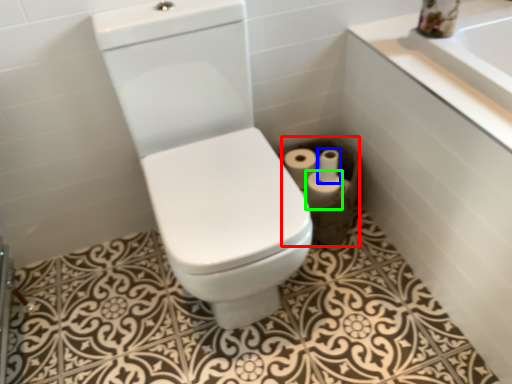
Question: Which object is the farthest from toilet paper (highlighted by a red box)? Choose among these: toilet paper (highlighted by a blue box) or toilet paper (highlighted by a green box).

Choices:
 (A) toilet paper
 (B) toilet paper

Answer: (A)